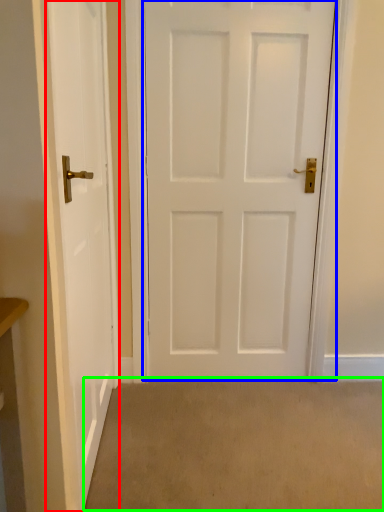
Question: Which object is positioned closest to door (highlighted by a red box)? Select from door (highlighted by a blue box) and plain (highlighted by a green box).

Choices:
 (A) door
 (B) plain

Answer: (A)